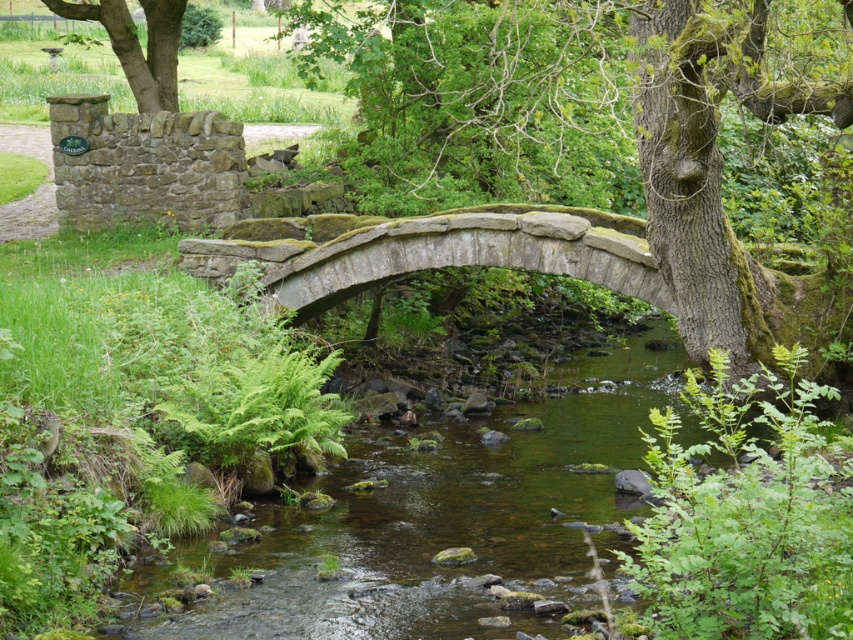
Between green mossy river at center and green mossy bark tree at center, which one is positioned lower?

green mossy river at center is lower down.

Locate an element on the screen. Image resolution: width=853 pixels, height=640 pixels. green mossy river at center is located at coordinates (445, 520).

Locate an element on the screen. green mossy river at center is located at coordinates (445, 520).

Who is more distant from viewer, (514, 480) or (172, 109)?

Point (172, 109)

Does point (640, 444) come farther from viewer compared to point (102, 10)?

No.

The height and width of the screenshot is (640, 853). What are the coordinates of `green mossy river at center` in the screenshot? It's located at (445, 520).

Does green mossy bark tree at center appear on the right side of green mossy tree at upper left?

Indeed, green mossy bark tree at center is positioned on the right side of green mossy tree at upper left.

You are a GUI agent. You are given a task and a screenshot of the screen. Output one action in this format:
    pyautogui.click(x=<x>, y=<y>)
    Task: Click on the green mossy bark tree at center
    This screenshot has width=853, height=640.
    Given the screenshot: What is the action you would take?
    pyautogui.click(x=721, y=188)